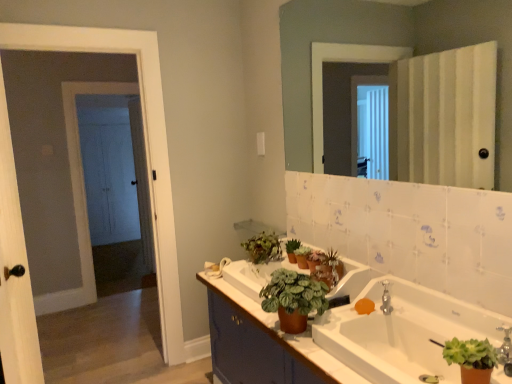
Question: Should I look upward or downward to see silver metallic faucet at upper right?

Choices:
 (A) down
 (B) up

Answer: (A)

Question: Does green matte plant at upper center, the third houseplant from the left, come behind green matte houseplant at center, the second houseplant viewed from the left?

Choices:
 (A) yes
 (B) no

Answer: (A)

Question: Is green matte plant at upper center, the third houseplant from the left, taller than green matte houseplant at center, the third houseplant when ordered from right to left?

Choices:
 (A) no
 (B) yes

Answer: (A)

Question: Is green matte plant at upper center, the 4th houseplant when ordered from front to back, closer to the viewer compared to green matte houseplant at center, the second houseplant viewed from the left?

Choices:
 (A) yes
 (B) no

Answer: (B)

Question: Can you confirm if green matte plant at upper center, the 4th houseplant when ordered from front to back, is smaller than green matte houseplant at center, the third houseplant when ordered from right to left?

Choices:
 (A) yes
 (B) no

Answer: (A)

Question: Considering the relative sizes of green matte plant at upper center, positioned as the first houseplant in back-to-front order, and green matte houseplant at center, which ranks as the second houseplant in front-to-back order, in the image provided, is green matte plant at upper center, positioned as the first houseplant in back-to-front order, shorter than green matte houseplant at center, which ranks as the second houseplant in front-to-back order,?

Choices:
 (A) yes
 (B) no

Answer: (A)

Question: From the image's perspective, is green matte plant at upper center, the third houseplant from the left, located beneath green matte houseplant at center, the third houseplant viewed from the back?

Choices:
 (A) yes
 (B) no

Answer: (B)

Question: Considering the relative positions of white matte towel bar at center and silver metallic faucet at upper right in the image provided, is white matte towel bar at center to the left of silver metallic faucet at upper right from the viewer's perspective?

Choices:
 (A) no
 (B) yes

Answer: (B)

Question: From a real-world perspective, is white matte towel bar at center positioned under silver metallic faucet at upper right based on gravity?

Choices:
 (A) no
 (B) yes

Answer: (B)

Question: Is white matte towel bar at center further to the viewer compared to silver metallic faucet at upper right?

Choices:
 (A) yes
 (B) no

Answer: (A)

Question: Is white matte towel bar at center positioned far away from silver metallic faucet at upper right?

Choices:
 (A) no
 (B) yes

Answer: (A)

Question: Considering the relative sizes of white matte towel bar at center and silver metallic faucet at upper right in the image provided, is white matte towel bar at center bigger than silver metallic faucet at upper right?

Choices:
 (A) yes
 (B) no

Answer: (A)

Question: Is white matte towel bar at center wider than silver metallic faucet at upper right?

Choices:
 (A) yes
 (B) no

Answer: (A)

Question: Could you tell me if orange matte soap at sink is turned towards green matte plant at center?

Choices:
 (A) no
 (B) yes

Answer: (A)